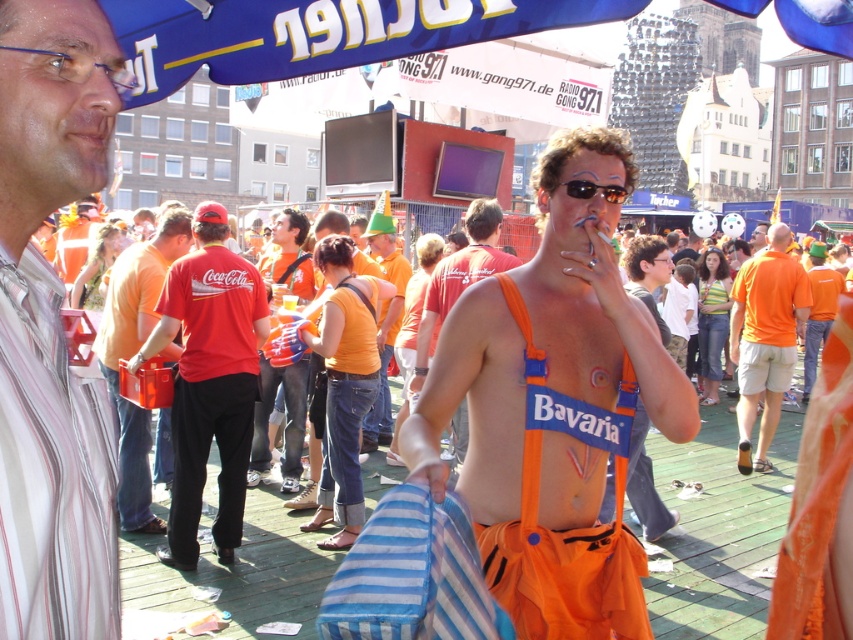
Question: Can you confirm if striped shirt at left is positioned to the left of red cotton shirt at center?

Choices:
 (A) yes
 (B) no

Answer: (B)

Question: Among these points, which one is farthest from the camera?

Choices:
 (A) (747, 472)
 (B) (115, 292)

Answer: (A)

Question: Which point is closer to the camera?

Choices:
 (A) (469, 429)
 (B) (61, 28)
 (C) (740, 332)

Answer: (B)

Question: Based on their relative distances, which object is farther from the orange fabric overalls at center?

Choices:
 (A) red cotton shirt at center
 (B) striped shirt at left
 (C) orange fabric at center
 (D) orange cotton shirt at center

Answer: (B)

Question: Considering the relative positions of striped shirt at left and orange cotton shirt at center in the image provided, where is striped shirt at left located with respect to orange cotton shirt at center?

Choices:
 (A) right
 (B) left

Answer: (B)

Question: Can you confirm if matte red t-shirt at center is positioned above orange fabric overalls at center?

Choices:
 (A) no
 (B) yes

Answer: (A)